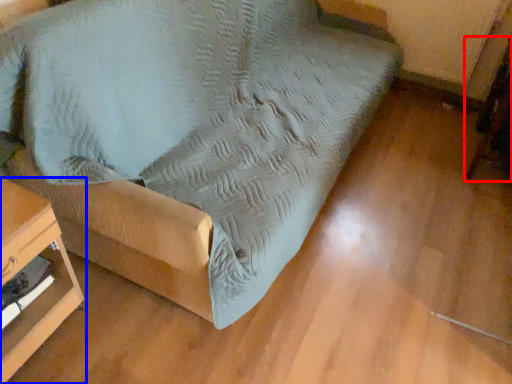
Question: Which object is closer to the camera taking this photo, swivel chair (highlighted by a red box) or furniture (highlighted by a blue box)?

Choices:
 (A) swivel chair
 (B) furniture

Answer: (B)